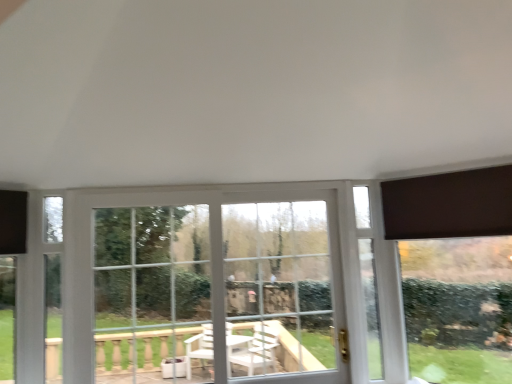
The width and height of the screenshot is (512, 384). Find the location of `dark brown fabric at upper right`. dark brown fabric at upper right is located at coordinates (449, 205).

Locate an element on the screen. Image resolution: width=512 pixels, height=384 pixels. dark brown fabric at upper right is located at coordinates (449, 205).

Is white plastic window at center surrounded by clear glass bay window at center?

Yes, white plastic window at center is a part of clear glass bay window at center.

Looking at this image, which of these two, clear glass bay window at center or white plastic window at center, is bigger?

clear glass bay window at center.

From a real-world perspective, is clear glass bay window at center under white plastic window at center?

No, from a real-world perspective, clear glass bay window at center is not beneath white plastic window at center.

In the scene shown: Can you confirm if clear glass bay window at center is shorter than white plastic window at center?

In fact, clear glass bay window at center may be taller than white plastic window at center.

Between white plastic window at center and clear glass bay window at center, which one is positioned behind?

white plastic window at center is further away from the camera.

Where is `window frame that is under the clear glass bay window at center (from a real-world perspective)`? Image resolution: width=512 pixels, height=384 pixels. window frame that is under the clear glass bay window at center (from a real-world perspective) is located at coordinates (284, 287).

Which is more to the left, white plastic window at center or clear glass bay window at center?

From the viewer's perspective, clear glass bay window at center appears more on the left side.

Does white plastic window at center have a lesser height compared to clear glass bay window at center?

Correct, white plastic window at center is not as tall as clear glass bay window at center.

Does clear glass bay window at center lie behind dark brown fabric at upper right?

Yes, clear glass bay window at center is further from the camera.

In terms of height, does clear glass bay window at center look taller or shorter compared to dark brown fabric at upper right?

In the image, clear glass bay window at center appears to be taller than dark brown fabric at upper right.

You are a GUI agent. You are given a task and a screenshot of the screen. Output one action in this format:
    pyautogui.click(x=<x>, y=<y>)
    Task: Click on the bay window behind the dark brown fabric at upper right
    
    Given the screenshot: What is the action you would take?
    pyautogui.click(x=217, y=283)

Is clear glass bay window at center thinner than dark brown fabric at upper right?

No.

Does dark brown fabric at upper right have a lesser height compared to clear glass bay window at center?

Yes, dark brown fabric at upper right is shorter than clear glass bay window at center.

Consider the image. Between dark brown fabric at upper right and clear glass bay window at center, which one has larger width?

clear glass bay window at center is wider.

Based on their sizes in the image, would you say dark brown fabric at upper right is bigger or smaller than clear glass bay window at center?

Clearly, dark brown fabric at upper right is smaller in size than clear glass bay window at center.

Which is in front, point (328, 362) or point (411, 225)?

Point (411, 225)

From the image's perspective, which object appears higher, white plastic window at center or dark brown fabric at upper right?

dark brown fabric at upper right.

Is white plastic window at center outside of dark brown fabric at upper right?

white plastic window at center lies outside dark brown fabric at upper right's area.

Is dark brown fabric at upper right looking in the opposite direction of white plastic window at center?

No, white plastic window at center is not at the back of dark brown fabric at upper right.

Consider the image. From the image's perspective, would you say dark brown fabric at upper right is positioned over white plastic window at center?

Yes, from the image's perspective, dark brown fabric at upper right is on top of white plastic window at center.

Who is smaller, dark brown fabric at upper right or white plastic window at center?

Smaller between the two is dark brown fabric at upper right.

The image size is (512, 384). Identify the location of window frame behind the clear glass bay window at center. (284, 287).

Find the location of a particular element. The width and height of the screenshot is (512, 384). window frame on the right of clear glass bay window at center is located at coordinates (284, 287).

From the image, which object appears to be nearer to clear glass bay window at center, white plastic window at center or dark brown fabric at upper right?

white plastic window at center.

Looking at the image, which one is located further to dark brown fabric at upper right, white plastic window at center or clear glass bay window at center?

clear glass bay window at center.

Estimate the real-world distances between objects in this image. Which object is closer to white plastic window at center, dark brown fabric at upper right or clear glass bay window at center?

Based on the image, clear glass bay window at center appears to be nearer to white plastic window at center.

When comparing their distances from dark brown fabric at upper right, does clear glass bay window at center or white plastic window at center seem further?

clear glass bay window at center.

From the image, which object appears to be farther from white plastic window at center, clear glass bay window at center or dark brown fabric at upper right?

dark brown fabric at upper right lies further to white plastic window at center than the other object.

Considering their positions, is dark brown fabric at upper right positioned further to clear glass bay window at center than white plastic window at center?

dark brown fabric at upper right is positioned further to the anchor clear glass bay window at center.

Locate an element on the screen. Image resolution: width=512 pixels, height=384 pixels. window frame located between clear glass bay window at center and dark brown fabric at upper right in the left-right direction is located at coordinates (284, 287).